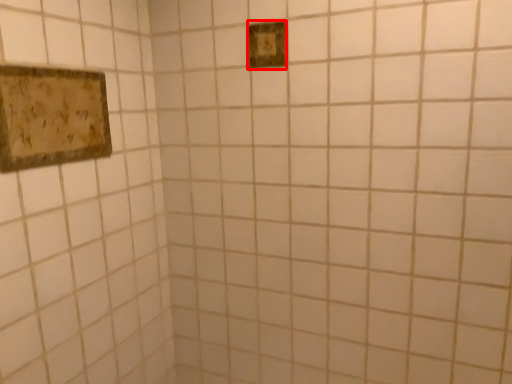
Question: From the image, what is the correct spatial relationship of light switch (annotated by the red box) in relation to picture frame?

Choices:
 (A) left
 (B) right

Answer: (B)